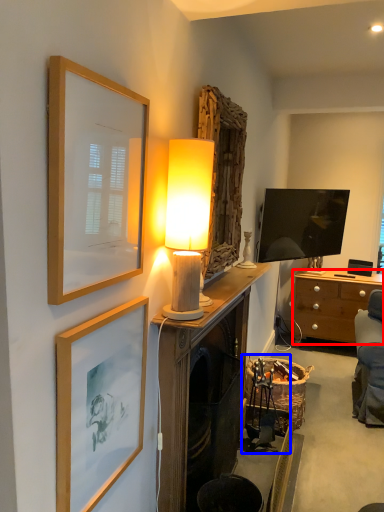
Question: Which object is further to the camera taking this photo, desk (highlighted by a red box) or swivel chair (highlighted by a blue box)?

Choices:
 (A) desk
 (B) swivel chair

Answer: (A)